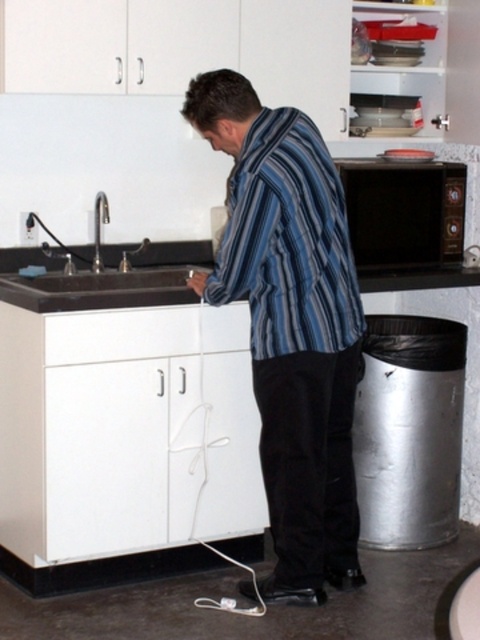
This screenshot has width=480, height=640. What do you see at coordinates (288, 241) in the screenshot?
I see `striped cotton shirt at center` at bounding box center [288, 241].

Between point (325, 156) and point (460, 218), which one is positioned behind?

Positioned behind is point (460, 218).

Locate an element on the screen. striped cotton shirt at center is located at coordinates (288, 241).

Which is below, black matte microwave at upper right or brushed metal faucet at left?

Positioned lower is brushed metal faucet at left.

Measure the distance from black matte microwave at upper right to brushed metal faucet at left.

black matte microwave at upper right and brushed metal faucet at left are 3.86 feet apart from each other.

Between point (444, 259) and point (95, 205), which one is positioned behind?

Positioned behind is point (444, 259).

Where is `black matte microwave at upper right`? Image resolution: width=480 pixels, height=640 pixels. black matte microwave at upper right is located at coordinates (404, 212).

Does blue striped shirt at center have a lesser width compared to brushed metal faucet at left?

Incorrect, blue striped shirt at center's width is not less than brushed metal faucet at left's.

Can you confirm if blue striped shirt at center is positioned above brushed metal faucet at left?

No.

Which is behind, point (222, 72) or point (101, 212)?

The point (101, 212) is behind.

This screenshot has height=640, width=480. In order to click on blue striped shirt at center in this screenshot , I will do `click(289, 324)`.